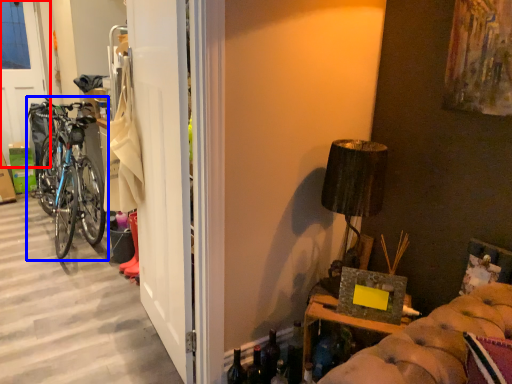
Question: Among these objects, which one is nearest to the camera, screen door (highlighted by a red box) or bicycle (highlighted by a blue box)?

Choices:
 (A) screen door
 (B) bicycle

Answer: (B)